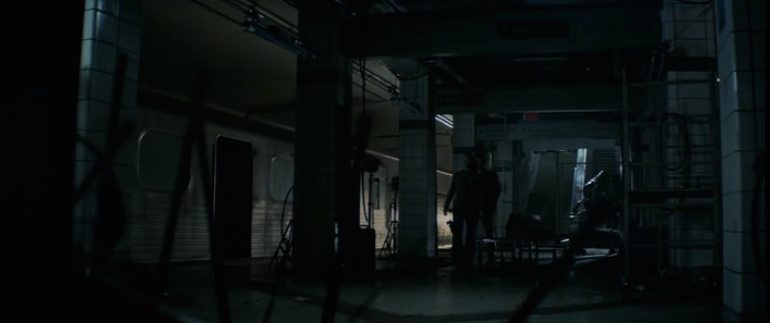
Locate an element on the screen. windows is located at coordinates (168, 159), (289, 181).